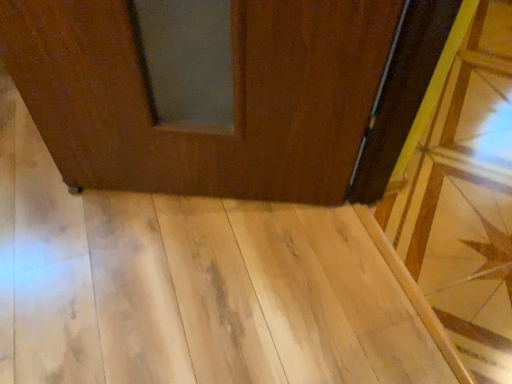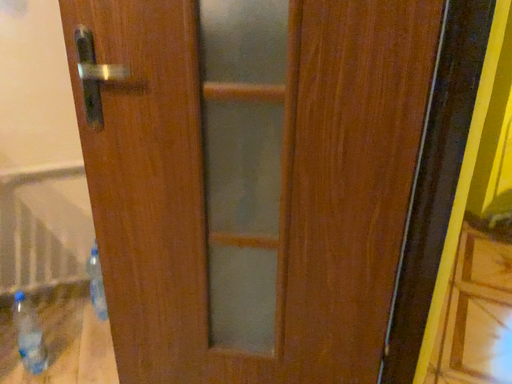
Question: How did the camera likely rotate when shooting the video?

Choices:
 (A) rotated downward
 (B) rotated upward

Answer: (B)